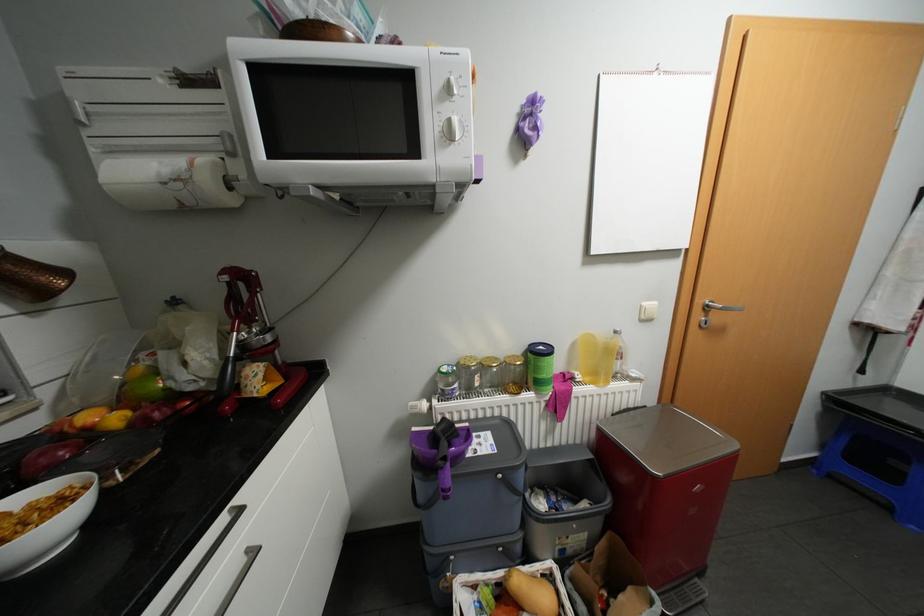
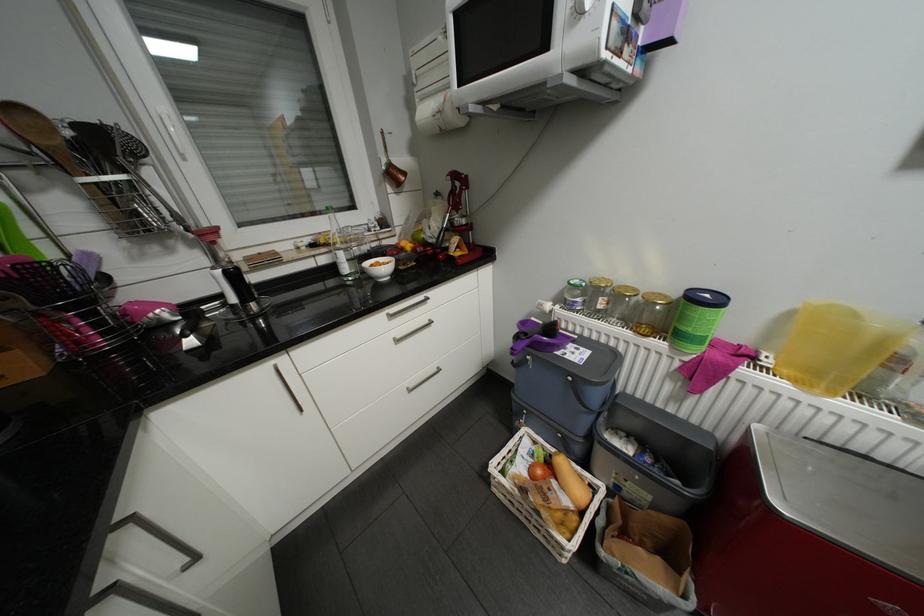
First-person continuous shooting, in which direction is the camera rotating?

The rotation direction of the camera is left-down.